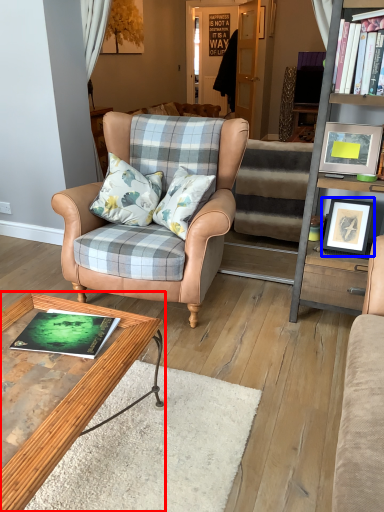
Question: Which point is further to the camera, coffee table (highlighted by a red box) or picture frame (highlighted by a blue box)?

Choices:
 (A) coffee table
 (B) picture frame

Answer: (B)